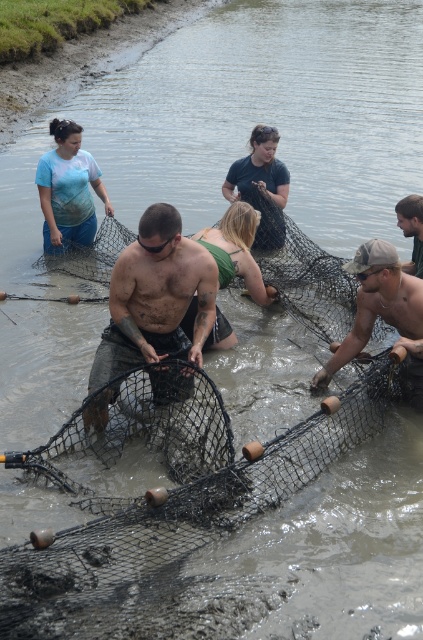
Who is more forward, (109, 285) or (40, 202)?

Point (109, 285) is more forward.

Which is behind, point (151, 310) or point (52, 243)?

The point (52, 243) is behind.

You are a GUI agent. You are given a task and a screenshot of the screen. Output one action in this format:
    pyautogui.click(x=<x>, y=<y>)
    Task: Click on the dirty black net at center
    
    Given the screenshot: What is the action you would take?
    pyautogui.click(x=156, y=298)

Is point (326, 381) farther from camera compared to point (422, 246)?

No, (326, 381) is closer to viewer.

Who is lower down, rusty metal net at center or dark brown leather jacket at upper right?

rusty metal net at center is lower down.

Locate an element on the screen. The height and width of the screenshot is (640, 423). rusty metal net at center is located at coordinates (382, 314).

Does dirty black net at center have a greater height compared to rusty metal net at center?

Correct, dirty black net at center is much taller as rusty metal net at center.

Which is more to the left, dirty black net at center or rusty metal net at center?

Positioned to the left is dirty black net at center.

Image resolution: width=423 pixels, height=640 pixels. Find the location of `dirty black net at center`. dirty black net at center is located at coordinates (156, 298).